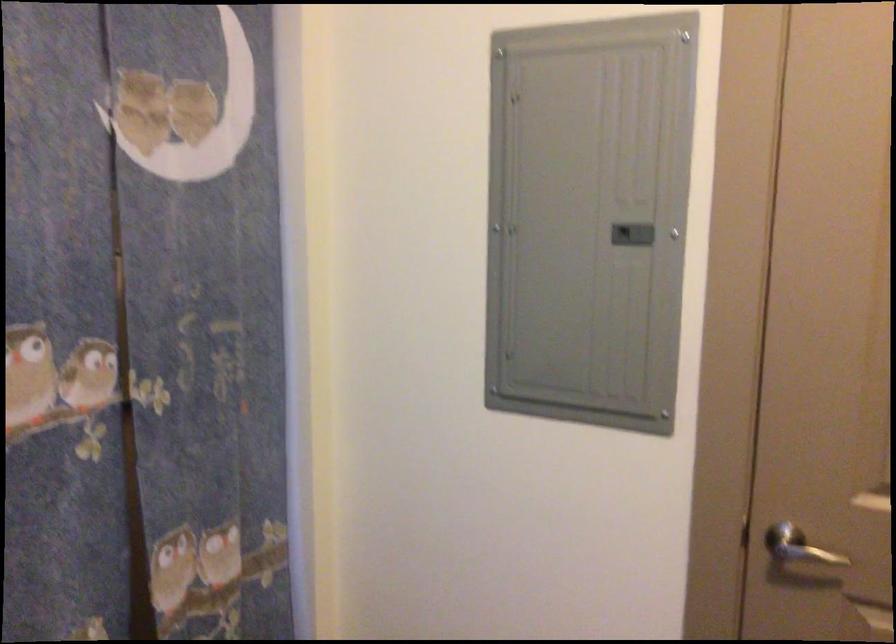
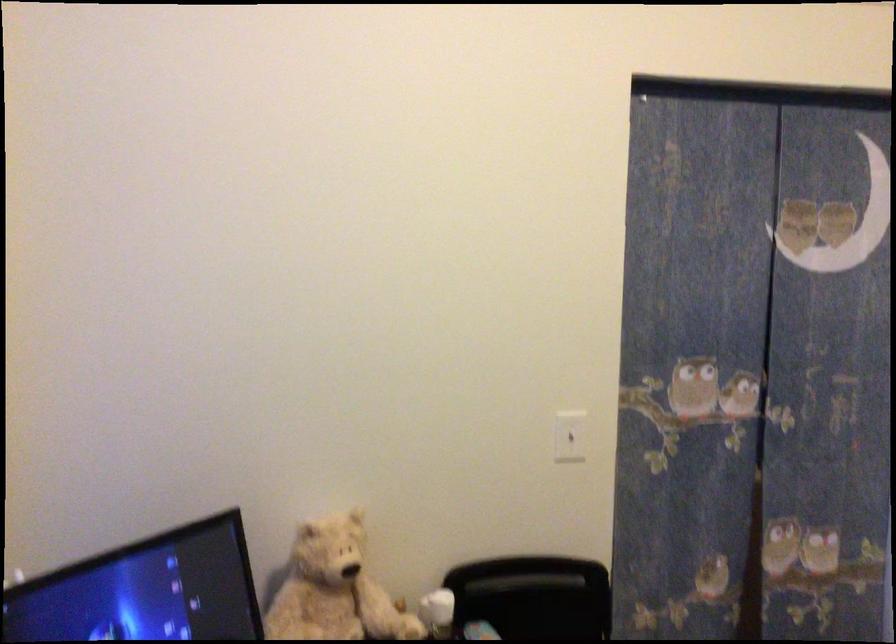
Question: The camera is either moving clockwise (left) or counter-clockwise (right) around the object. The first image is from the beginning of the video and the second image is from the end. Is the camera moving left or right when shooting the video?

Choices:
 (A) Left
 (B) Right

Answer: (B)